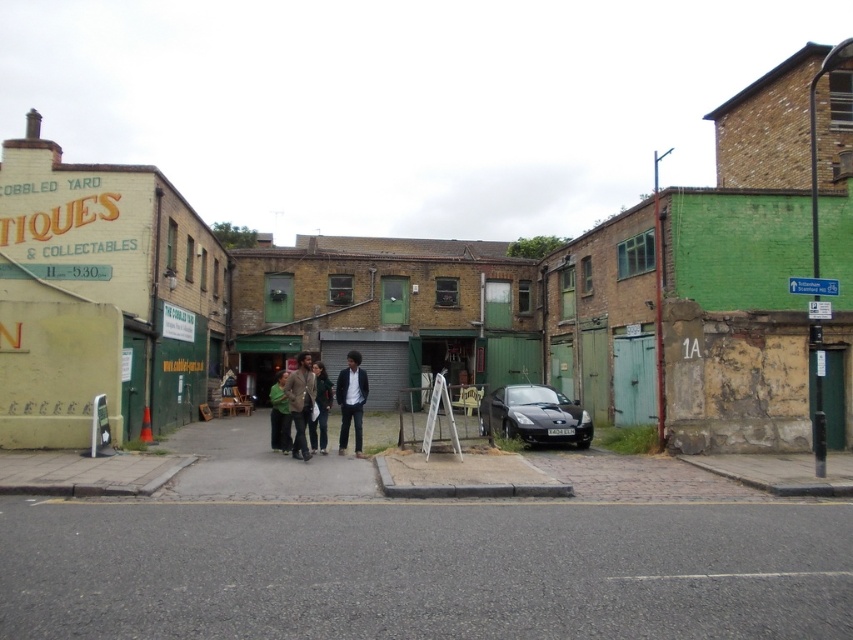
From the picture: Does dark blue jeans at center have a greater height compared to dark brown leather jacket at center?

Yes.

Is point (358, 428) farther from camera compared to point (306, 404)?

That is True.

The height and width of the screenshot is (640, 853). Find the location of `dark blue jeans at center`. dark blue jeans at center is located at coordinates (351, 401).

Who is higher up, dark brown leather jacket at center or dark green jacket at center?

dark brown leather jacket at center is higher up.

Does dark brown leather jacket at center have a smaller size compared to dark green jacket at center?

Actually, dark brown leather jacket at center might be larger than dark green jacket at center.

The image size is (853, 640). What do you see at coordinates (300, 403) in the screenshot? I see `dark brown leather jacket at center` at bounding box center [300, 403].

What are the coordinates of `dark brown leather jacket at center` in the screenshot? It's located at (300, 403).

Who is more distant from viewer, (538, 401) or (308, 355)?

Point (308, 355)

Where is `shiny black car at center`? The image size is (853, 640). shiny black car at center is located at coordinates (534, 416).

Where is `shiny black car at center`? shiny black car at center is located at coordinates (534, 416).

Where is `shiny black car at center`? The width and height of the screenshot is (853, 640). shiny black car at center is located at coordinates 534,416.